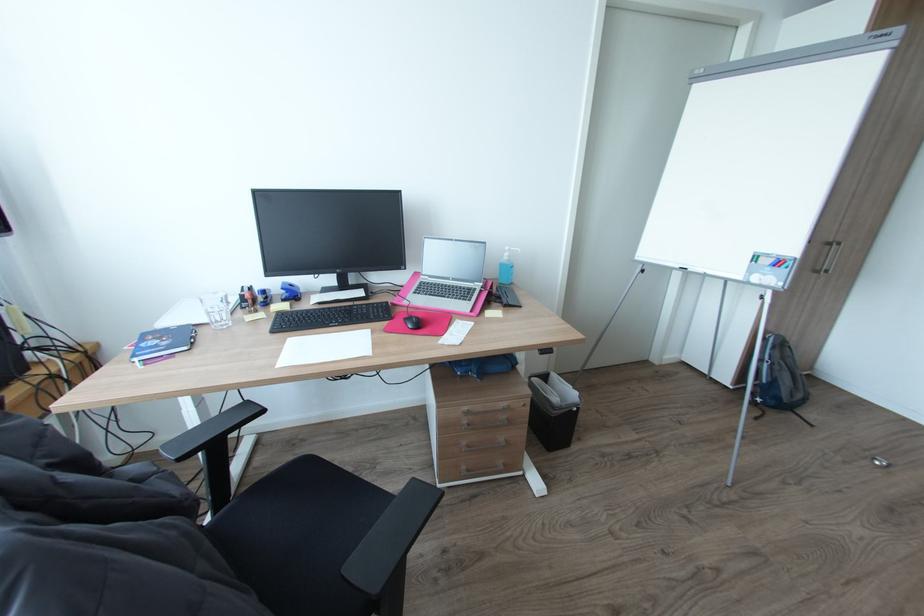
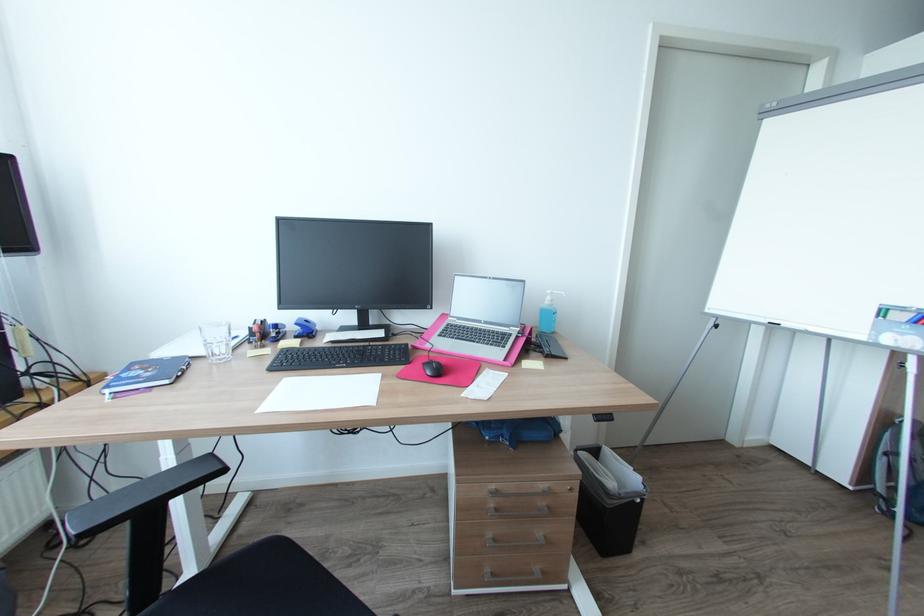
Locate, in the second image, the point that corresponds to point 513,267 in the first image.

(554, 313)